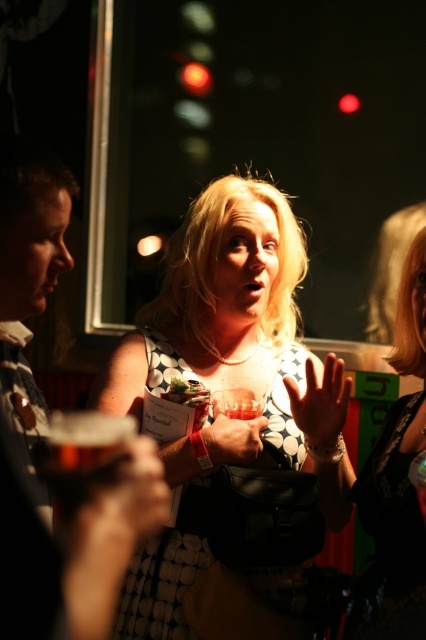
Question: Where is matte black shirt at left located in relation to matte black dress at center in the image?

Choices:
 (A) below
 (B) above

Answer: (B)

Question: Does matte black shirt at left appear on the left side of matte black dress at center?

Choices:
 (A) yes
 (B) no

Answer: (A)

Question: Is white dotted dress at center above smooth skin hand at center?

Choices:
 (A) yes
 (B) no

Answer: (B)

Question: Which of these objects is positioned closest to the matte black shirt at left?

Choices:
 (A) matte black dress at center
 (B) matte black purse at center
 (C) polka dot dress at center
 (D) white dotted dress at center

Answer: (B)

Question: Among these points, which one is nearest to the camera?

Choices:
 (A) (121, 563)
 (B) (362, 579)
 (C) (181, 624)

Answer: (A)

Question: Which object appears farthest from the camera in this image?

Choices:
 (A) matte black dress at center
 (B) polka dot dress at center
 (C) smooth skin hand at center
 (D) matte black purse at center

Answer: (D)